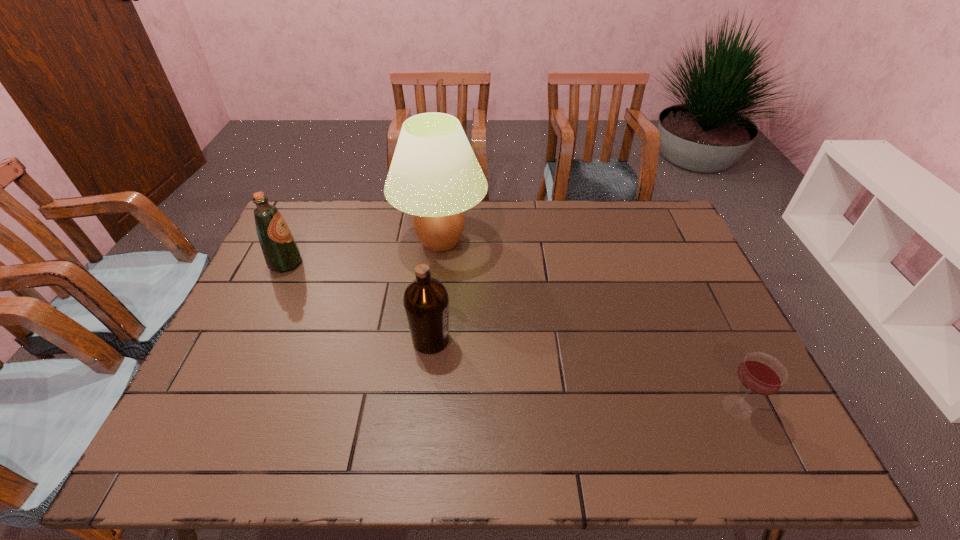
Locate an element on the screen. This screenshot has height=540, width=960. vacant space that satisfies the following two spatial constraints: 1. on the shade of the lampshade; 2. on the front-facing side of the leftmost object is located at coordinates (438, 263).

This screenshot has width=960, height=540. In order to click on free space that satisfies the following two spatial constraints: 1. on the label of the right olive oil; 2. on the back side of the wineglass in this screenshot , I will do `click(424, 407)`.

What are the coordinates of `vacant space that satisfies the following two spatial constraints: 1. on the shade of the tallest object; 2. on the front-facing side of the left olive oil` in the screenshot? It's located at (438, 263).

This screenshot has height=540, width=960. In order to click on free space that satisfies the following two spatial constraints: 1. on the shade of the lampshade; 2. on the left side of the shortest object in this screenshot , I will do `click(423, 407)`.

The image size is (960, 540). What are the coordinates of `vacant region that satisfies the following two spatial constraints: 1. on the back side of the wineglass; 2. on the front-facing side of the left olive oil` in the screenshot? It's located at (671, 263).

Where is `blank area in the image that satisfies the following two spatial constraints: 1. on the label of the nearer olive oil; 2. on the left side of the rightmost object`? blank area in the image that satisfies the following two spatial constraints: 1. on the label of the nearer olive oil; 2. on the left side of the rightmost object is located at coordinates (424, 407).

At what (x,y) coordinates should I click in order to perform the action: click on free location that satisfies the following two spatial constraints: 1. on the shade of the rightmost object; 2. on the left side of the lampshade. Please return your answer as a coordinate pair (x, y). Looking at the image, I should click on (423, 407).

Where is `free space that satisfies the following two spatial constraints: 1. on the label of the wineglass; 2. on the right side of the nearer olive oil`? This screenshot has height=540, width=960. free space that satisfies the following two spatial constraints: 1. on the label of the wineglass; 2. on the right side of the nearer olive oil is located at coordinates (424, 407).

Locate an element on the screen. Image resolution: width=960 pixels, height=540 pixels. vacant space that satisfies the following two spatial constraints: 1. on the front-facing side of the left olive oil; 2. on the left side of the wineglass is located at coordinates (218, 407).